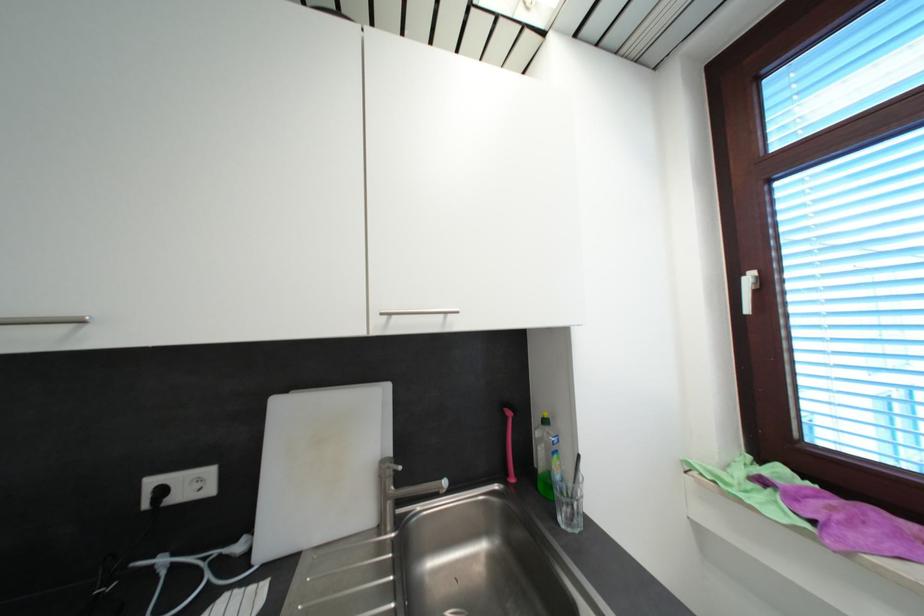
This screenshot has width=924, height=616. I want to click on white window handle, so click(748, 290).